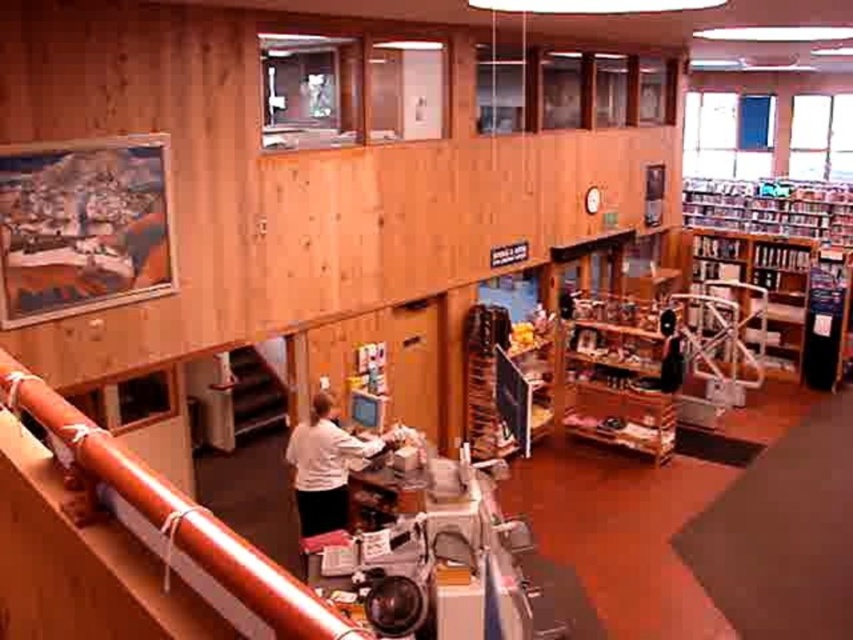
Is brown polished wood rail at lower left positioned in front of white matte shirt at center?

Yes, it is.

The height and width of the screenshot is (640, 853). I want to click on brown polished wood rail at lower left, so [125, 545].

Is point (19, 372) in front of point (335, 492)?

Yes.

What are the coordinates of `brown polished wood rail at lower left` in the screenshot? It's located at (125, 545).

Does brown polished wood rail at lower left have a lesser height compared to wooden bookshelf at right?

Correct, brown polished wood rail at lower left is not as tall as wooden bookshelf at right.

Is brown polished wood rail at lower left behind wooden bookshelf at right?

No, it is in front of wooden bookshelf at right.

Between point (62, 625) and point (753, 273), which one is positioned in front?

Positioned in front is point (62, 625).

The image size is (853, 640). What are the coordinates of `brown polished wood rail at lower left` in the screenshot? It's located at [x=125, y=545].

Is brown polished wood rail at lower left to the left of wooden shelves at center from the viewer's perspective?

Indeed, brown polished wood rail at lower left is positioned on the left side of wooden shelves at center.

Who is positioned more to the right, brown polished wood rail at lower left or wooden shelves at center?

wooden shelves at center

Locate an element on the screen. brown polished wood rail at lower left is located at coordinates (125, 545).